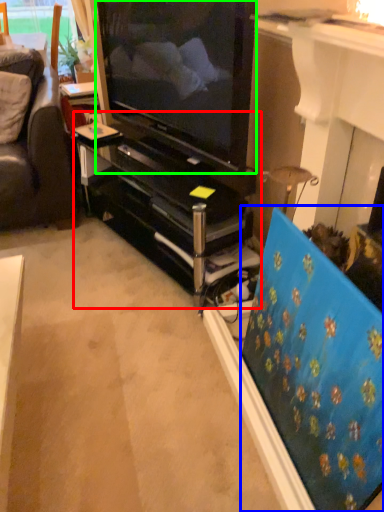
Question: Based on their relative distances, which object is nearer to tv cabinet (highlighted by a red box)? Choose from flat (highlighted by a blue box) and television (highlighted by a green box).

Choices:
 (A) flat
 (B) television

Answer: (B)